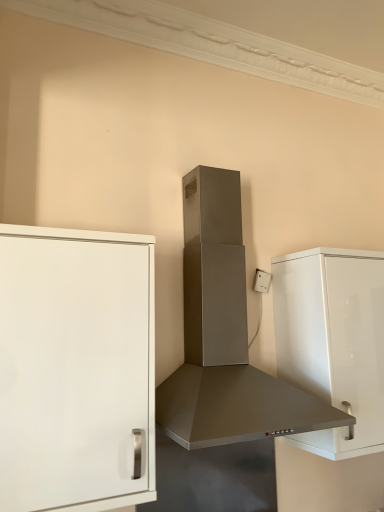
Question: Considering the relative sizes of satin silver range hood at center and white plastic electric outlet at upper right in the image provided, is satin silver range hood at center shorter than white plastic electric outlet at upper right?

Choices:
 (A) yes
 (B) no

Answer: (B)

Question: Does satin silver range hood at center have a larger size compared to white plastic electric outlet at upper right?

Choices:
 (A) yes
 (B) no

Answer: (A)

Question: Is satin silver range hood at center next to white plastic electric outlet at upper right?

Choices:
 (A) no
 (B) yes

Answer: (A)

Question: From the image's perspective, is satin silver range hood at center on top of white plastic electric outlet at upper right?

Choices:
 (A) no
 (B) yes

Answer: (B)

Question: From a real-world perspective, is satin silver range hood at center physically above white plastic electric outlet at upper right?

Choices:
 (A) no
 (B) yes

Answer: (A)

Question: Is satin silver range hood at center closer to camera compared to white plastic electric outlet at upper right?

Choices:
 (A) yes
 (B) no

Answer: (A)

Question: From the image's perspective, would you say white matte cabinet at left, which is counted as the second cabinetry, starting from the back, is shown under white glossy cabinet at right, which ranks as the 1th cabinetry in back-to-front order?

Choices:
 (A) yes
 (B) no

Answer: (B)

Question: Can you confirm if white matte cabinet at left, which is counted as the second cabinetry, starting from the back, is smaller than white glossy cabinet at right, which ranks as the 1th cabinetry in back-to-front order?

Choices:
 (A) no
 (B) yes

Answer: (B)

Question: Considering the relative sizes of white matte cabinet at left, which is counted as the 2th cabinetry, starting from the right, and white glossy cabinet at right, the 2th cabinetry when ordered from front to back, in the image provided, is white matte cabinet at left, which is counted as the 2th cabinetry, starting from the right, taller than white glossy cabinet at right, the 2th cabinetry when ordered from front to back,?

Choices:
 (A) no
 (B) yes

Answer: (B)

Question: Is white matte cabinet at left, which is counted as the second cabinetry, starting from the back, to the right of white glossy cabinet at right, the second cabinetry in the left-to-right sequence, from the viewer's perspective?

Choices:
 (A) no
 (B) yes

Answer: (A)

Question: Does white matte cabinet at left, which is the 1th cabinetry from left to right, have a larger size compared to white glossy cabinet at right, the second cabinetry in the left-to-right sequence?

Choices:
 (A) yes
 (B) no

Answer: (B)

Question: Considering the relative sizes of white matte cabinet at left, which is the 1th cabinetry from left to right, and white glossy cabinet at right, the 2th cabinetry when ordered from front to back, in the image provided, is white matte cabinet at left, which is the 1th cabinetry from left to right, wider than white glossy cabinet at right, the 2th cabinetry when ordered from front to back,?

Choices:
 (A) no
 (B) yes

Answer: (A)

Question: Is white plastic electric outlet at upper right touching satin silver range hood at center?

Choices:
 (A) no
 (B) yes

Answer: (A)